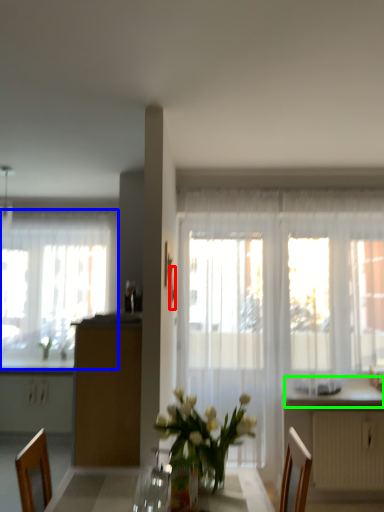
Question: Based on their relative distances, which object is nearer to picture frame (highlighted by a red box)? Choose from window (highlighted by a blue box) and counter top (highlighted by a green box).

Choices:
 (A) window
 (B) counter top

Answer: (B)